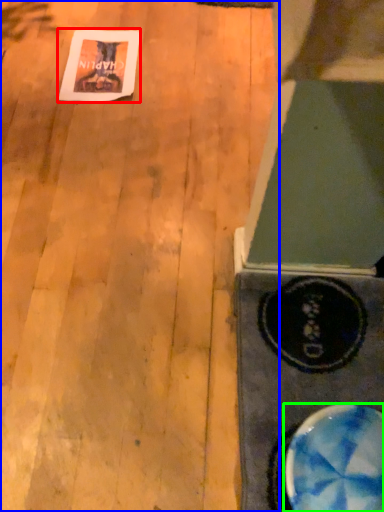
Question: Estimate the real-world distances between objects in this image. Which object is closer to postcard (highlighted by a red box), plywood (highlighted by a blue box) or bowl (highlighted by a green box)?

Choices:
 (A) plywood
 (B) bowl

Answer: (A)